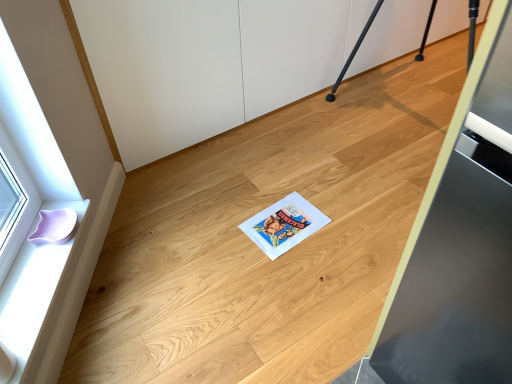
The width and height of the screenshot is (512, 384). What are the coordinates of `vacant point to the left of white paper comic book at center` in the screenshot? It's located at (222, 230).